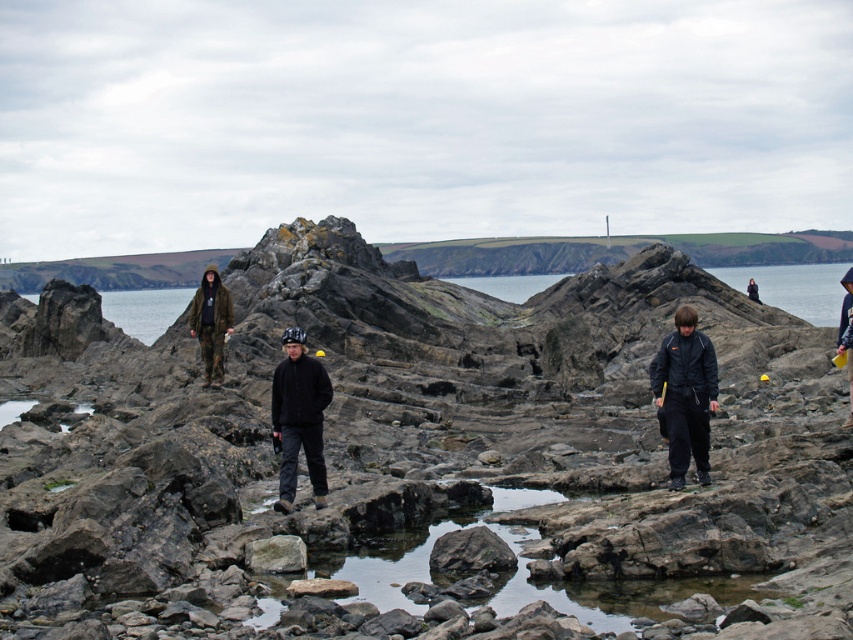
Based on the photo, you are a photographer standing at the camera position. You want to take a photo of both the point at coordinates point (299,410) and point (851,289). Which point will appear larger in your photo?

Point (299,410) is closer to the camera than point (851,289), so it will appear larger in the photo.

You are navigating a coastal area and need to place a small weather station on the gray rough rock at center. Given that the coordinates of the rock are at point 0.867, 0.324, can you confirm if this rock is positioned centrally within the image?

The gray rough rock at center is located at point (276,554), which indicates its central position in the image based on the coordinate system provided.